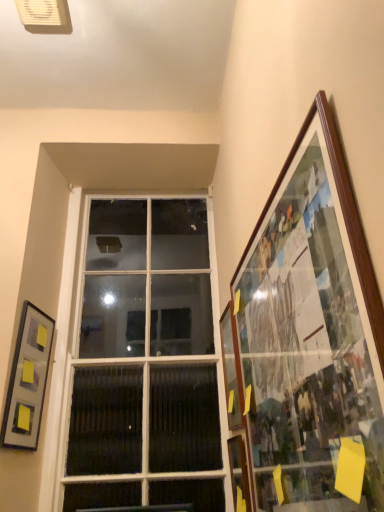
Question: Is white glass window at center inside the boundaries of wooden-framed collage at right, which is the 3th picture frame from left to right, or outside?

Choices:
 (A) outside
 (B) inside

Answer: (A)

Question: Considering their positions, is white glass window at center located in front of or behind wooden-framed collage at right, the 1th picture frame from the right?

Choices:
 (A) front
 (B) behind

Answer: (B)

Question: Considering the real-world distances, which object is closest to the wooden picture frame at right, positioned as the second picture frame in right-to-left order?

Choices:
 (A) white glass window at center
 (B) matte gray picture frame at left, marked as the 3th picture frame in a right-to-left arrangement
 (C) wooden-framed collage at right, the 1th picture frame from the right

Answer: (A)

Question: Based on their relative distances, which object is farther from the wooden picture frame at right, positioned as the second picture frame in right-to-left order?

Choices:
 (A) wooden-framed collage at right, which is the 3th picture frame from left to right
 (B) matte gray picture frame at left, the 1th picture frame when ordered from left to right
 (C) white glass window at center

Answer: (B)